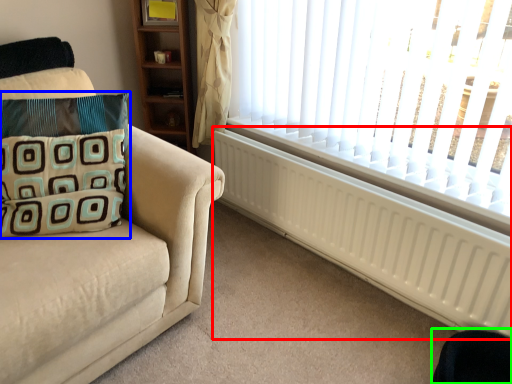
Question: Considering the real-world distances, which object is closest to radiator (highlighted by a red box)? pillow (highlighted by a blue box) or swivel chair (highlighted by a green box).

Choices:
 (A) pillow
 (B) swivel chair

Answer: (B)